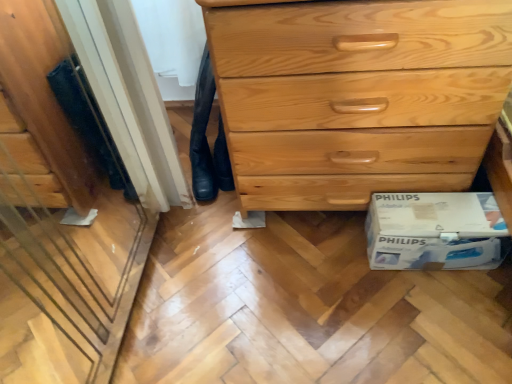
This screenshot has width=512, height=384. In order to click on free region on the left part of white cardboard box at lower right in this screenshot , I will do `click(342, 271)`.